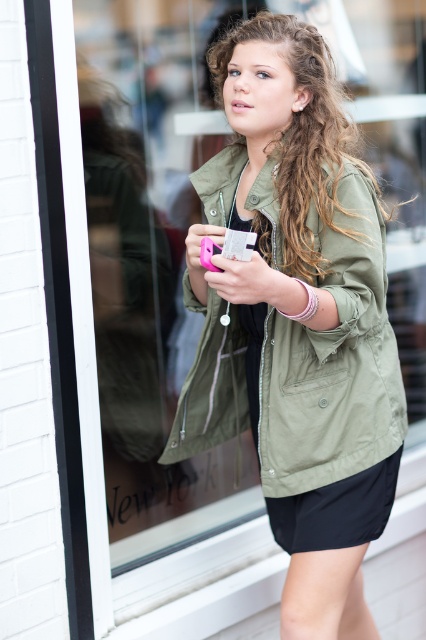
Question: Which point is farther from the camera taking this photo?

Choices:
 (A) (267, 412)
 (B) (400, 449)

Answer: (B)

Question: Can you confirm if olive green fabric jacket at center is bigger than black smooth shorts at lower center?

Choices:
 (A) yes
 (B) no

Answer: (A)

Question: Among these points, which one is nearest to the camera?

Choices:
 (A) (354, 524)
 (B) (261, 372)

Answer: (A)

Question: Can you confirm if olive green fabric jacket at center is positioned below black smooth shorts at lower center?

Choices:
 (A) yes
 (B) no

Answer: (B)

Question: Is olive green fabric jacket at center positioned behind black smooth shorts at lower center?

Choices:
 (A) yes
 (B) no

Answer: (B)

Question: Among these objects, which one is farthest from the camera?

Choices:
 (A) olive green fabric jacket at center
 (B) black smooth shorts at lower center

Answer: (B)